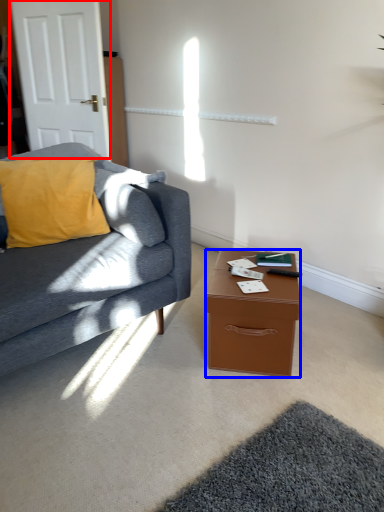
Question: Among these objects, which one is farthest to the camera, door (highlighted by a red box) or desk (highlighted by a blue box)?

Choices:
 (A) door
 (B) desk

Answer: (A)